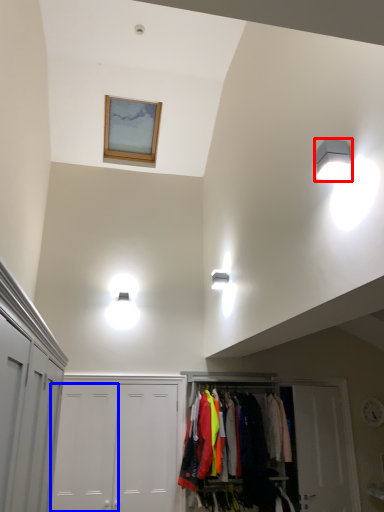
Question: Which object is closer to the camera taking this photo, light fixture (highlighted by a red box) or door (highlighted by a blue box)?

Choices:
 (A) light fixture
 (B) door

Answer: (A)